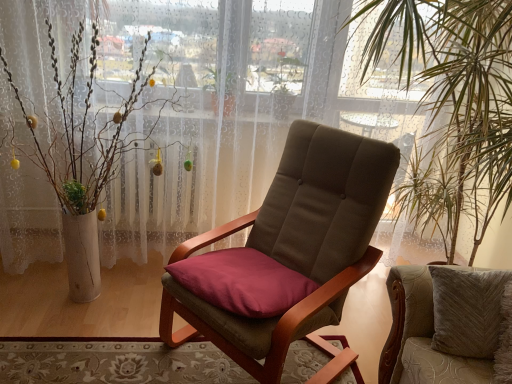
Question: Considering the relative positions of velvet beige cushion at center, the 2th chair positioned from the left, and green leafy plant at right in the image provided, is velvet beige cushion at center, the 2th chair positioned from the left, behind green leafy plant at right?

Choices:
 (A) yes
 (B) no

Answer: (A)

Question: From the image's perspective, would you say velvet beige cushion at center, the 2th chair positioned from the left, is shown under green leafy plant at right?

Choices:
 (A) yes
 (B) no

Answer: (A)

Question: Is velvet beige cushion at center, the 2th chair positioned from the left, oriented away from green leafy plant at right?

Choices:
 (A) no
 (B) yes

Answer: (B)

Question: Does velvet beige cushion at center, positioned as the first chair in right-to-left order, contain green leafy plant at right?

Choices:
 (A) yes
 (B) no

Answer: (B)

Question: Is velvet beige cushion at center, positioned as the first chair in right-to-left order, smaller than green leafy plant at right?

Choices:
 (A) no
 (B) yes

Answer: (B)

Question: Are velvet beige cushion at center, positioned as the first chair in right-to-left order, and green leafy plant at right located far from each other?

Choices:
 (A) no
 (B) yes

Answer: (A)

Question: Is velvet beige cushion at center, the 2th chair positioned from the left, at the left side of white textured vase at left?

Choices:
 (A) yes
 (B) no

Answer: (B)

Question: Does velvet beige cushion at center, positioned as the first chair in right-to-left order, have a lesser height compared to white textured vase at left?

Choices:
 (A) yes
 (B) no

Answer: (A)

Question: From a real-world perspective, is velvet beige cushion at center, positioned as the first chair in right-to-left order, beneath white textured vase at left?

Choices:
 (A) yes
 (B) no

Answer: (A)

Question: Is velvet beige cushion at center, the 2th chair positioned from the left, facing away from white textured vase at left?

Choices:
 (A) no
 (B) yes

Answer: (A)

Question: Considering the relative sizes of velvet beige cushion at center, the 2th chair positioned from the left, and white textured vase at left in the image provided, is velvet beige cushion at center, the 2th chair positioned from the left, wider than white textured vase at left?

Choices:
 (A) yes
 (B) no

Answer: (B)

Question: Can you confirm if velvet beige cushion at center, the 2th chair positioned from the left, is thinner than white textured vase at left?

Choices:
 (A) yes
 (B) no

Answer: (A)

Question: From the image's perspective, does carpeted rug at lower left appear lower than brown fabric chair at center, the first chair in the left-to-right sequence?

Choices:
 (A) yes
 (B) no

Answer: (A)